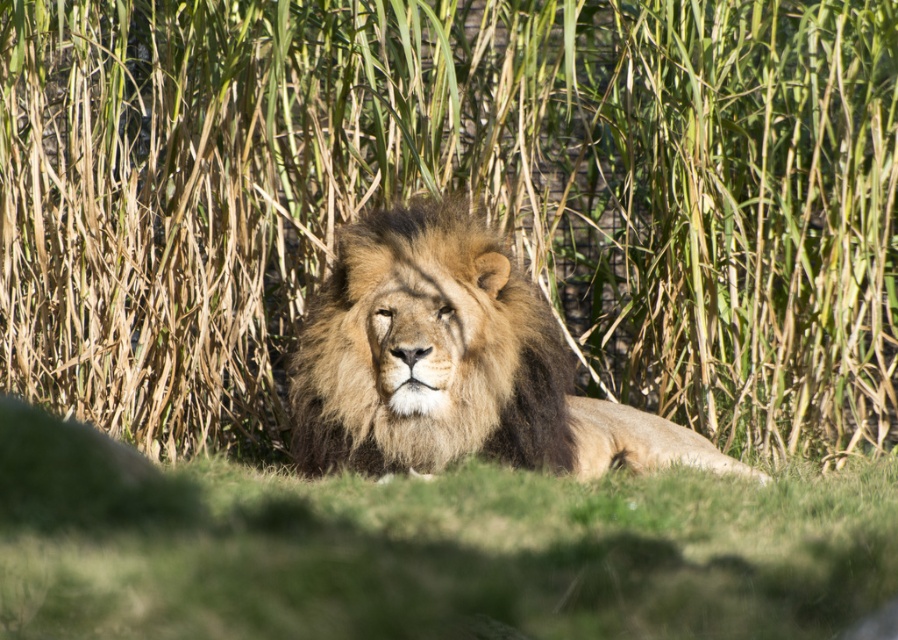
Consider the image. Is green soft grass at center positioned behind golden fur lion at center?

No.

Can you confirm if green soft grass at center is positioned below golden fur lion at center?

Indeed, green soft grass at center is positioned under golden fur lion at center.

Measure the distance between green soft grass at center and camera.

green soft grass at center is 5.00 meters from camera.

Locate an element on the screen. green soft grass at center is located at coordinates (423, 548).